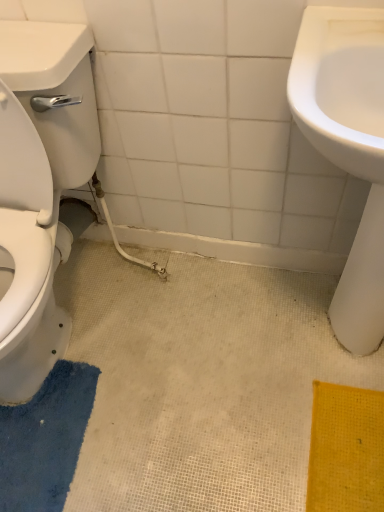
Question: From a real-world perspective, is blue textured bath mat at lower left over white glossy toilet at left?

Choices:
 (A) yes
 (B) no

Answer: (B)

Question: From the image's perspective, does blue textured bath mat at lower left appear lower than white glossy toilet at left?

Choices:
 (A) no
 (B) yes

Answer: (B)

Question: From the image's perspective, is blue textured bath mat at lower left on top of white glossy toilet at left?

Choices:
 (A) no
 (B) yes

Answer: (A)

Question: Can you confirm if blue textured bath mat at lower left is thinner than white glossy toilet at left?

Choices:
 (A) no
 (B) yes

Answer: (B)

Question: Can you confirm if blue textured bath mat at lower left is smaller than white glossy toilet at left?

Choices:
 (A) yes
 (B) no

Answer: (A)

Question: Considering the positions of blue textured bath mat at lower left and white glossy toilet at left in the image, is blue textured bath mat at lower left bigger or smaller than white glossy toilet at left?

Choices:
 (A) big
 (B) small

Answer: (B)

Question: Is blue textured bath mat at lower left inside the boundaries of white glossy toilet at left, or outside?

Choices:
 (A) inside
 (B) outside

Answer: (B)

Question: Is point (8, 444) closer or farther from the camera than point (59, 330)?

Choices:
 (A) closer
 (B) farther

Answer: (A)

Question: Considering the positions of blue textured bath mat at lower left and white glossy toilet at left in the image, is blue textured bath mat at lower left taller or shorter than white glossy toilet at left?

Choices:
 (A) short
 (B) tall

Answer: (A)

Question: In terms of size, does white glossy sink at right appear bigger or smaller than white glossy toilet at left?

Choices:
 (A) big
 (B) small

Answer: (B)

Question: Is white glossy sink at right inside the boundaries of white glossy toilet at left, or outside?

Choices:
 (A) outside
 (B) inside

Answer: (A)

Question: Is point (365, 274) positioned closer to the camera than point (49, 68)?

Choices:
 (A) farther
 (B) closer

Answer: (A)

Question: Based on their positions, is white glossy sink at right located to the left or right of white glossy toilet at left?

Choices:
 (A) right
 (B) left

Answer: (A)

Question: Is white glossy toilet at left in front of or behind white glossy sink at right in the image?

Choices:
 (A) behind
 (B) front

Answer: (B)

Question: Looking at their shapes, would you say white glossy toilet at left is wider or thinner than white glossy sink at right?

Choices:
 (A) thin
 (B) wide

Answer: (B)